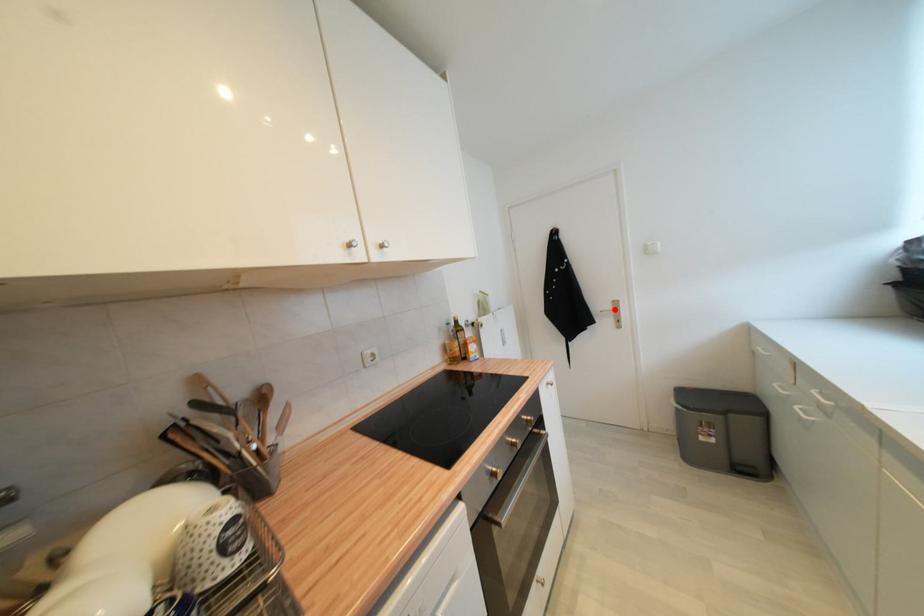
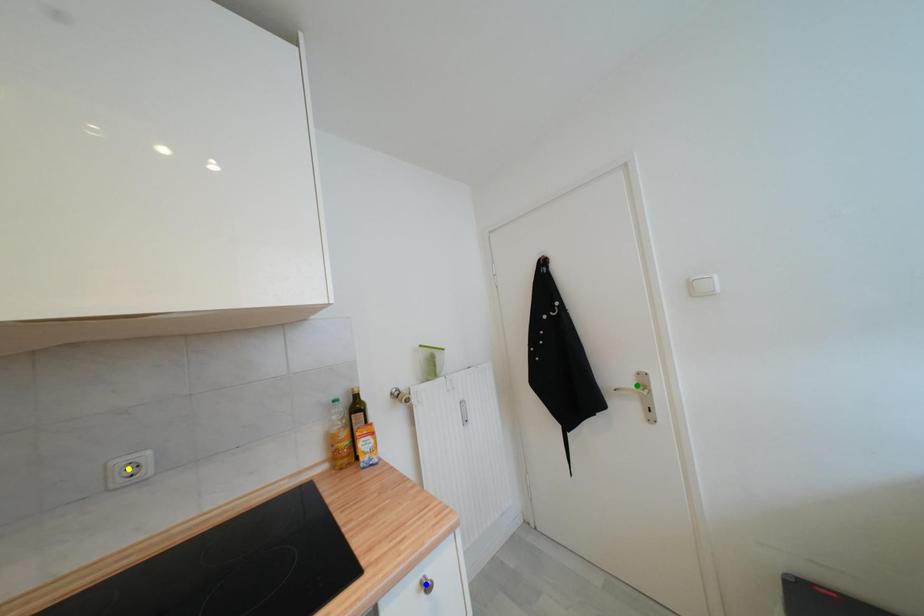
Question: I am providing you with two images of the same scene from different viewpoints. A red point is marked on the first image. You are given multiple points on the second image. Which spot in image 2 lines up with the point in image 1?

Choices:
 (A) blue point
 (B) yellow point
 (C) green point

Answer: (C)